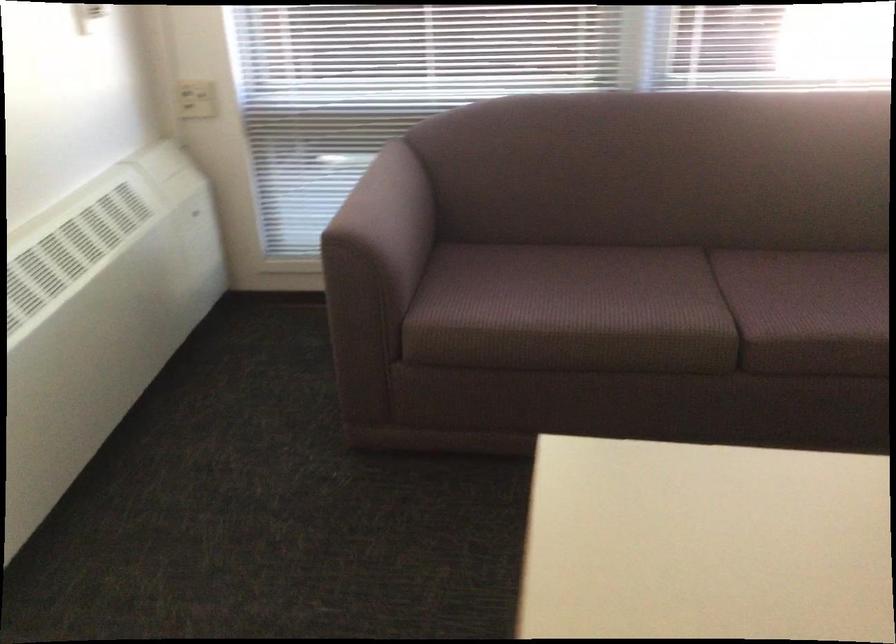
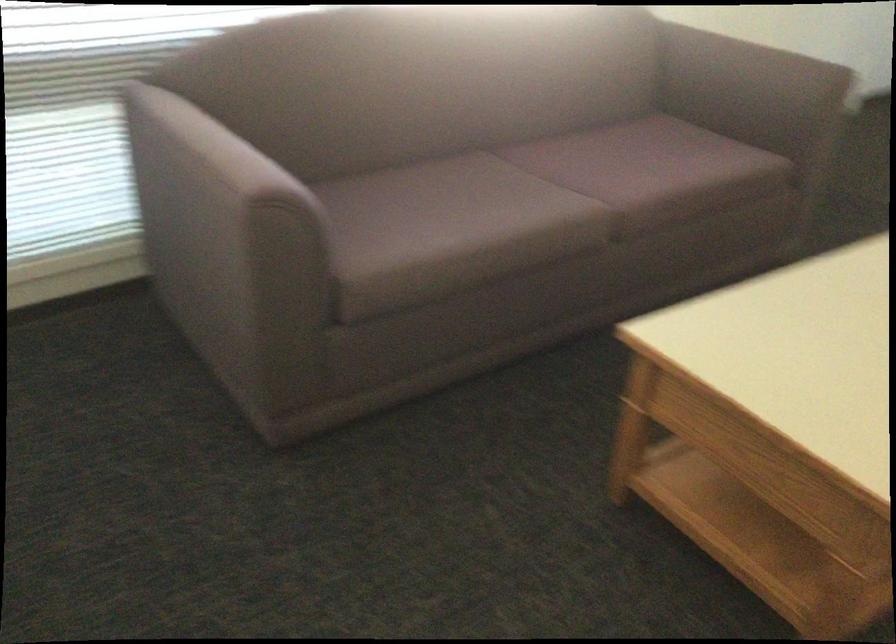
In the second image, find the point that corresponds to pixel 355 194 in the first image.

(216, 147)